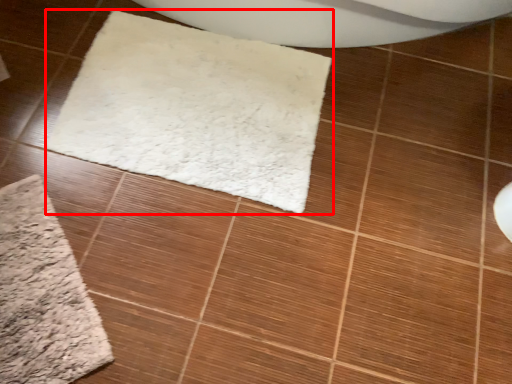
Question: From the image's perspective, considering the relative positions of mat (annotated by the red box) and bath mat in the image provided, where is mat (annotated by the red box) located with respect to the staircase?

Choices:
 (A) below
 (B) above

Answer: (B)